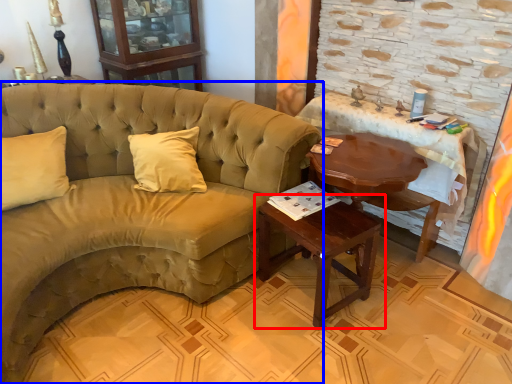
Question: Which point is further to the camera, table (highlighted by a red box) or studio couch (highlighted by a blue box)?

Choices:
 (A) table
 (B) studio couch

Answer: (A)